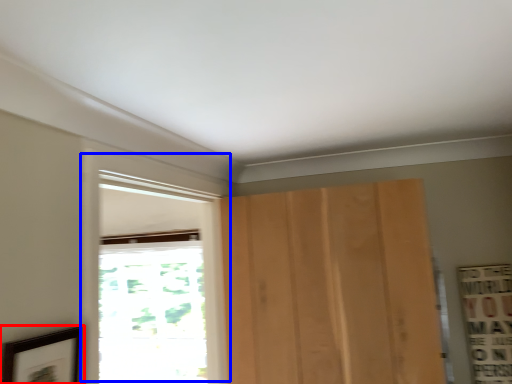
Question: Among these objects, which one is nearest to the camera, picture frame (highlighted by a red box) or window (highlighted by a blue box)?

Choices:
 (A) picture frame
 (B) window

Answer: (A)